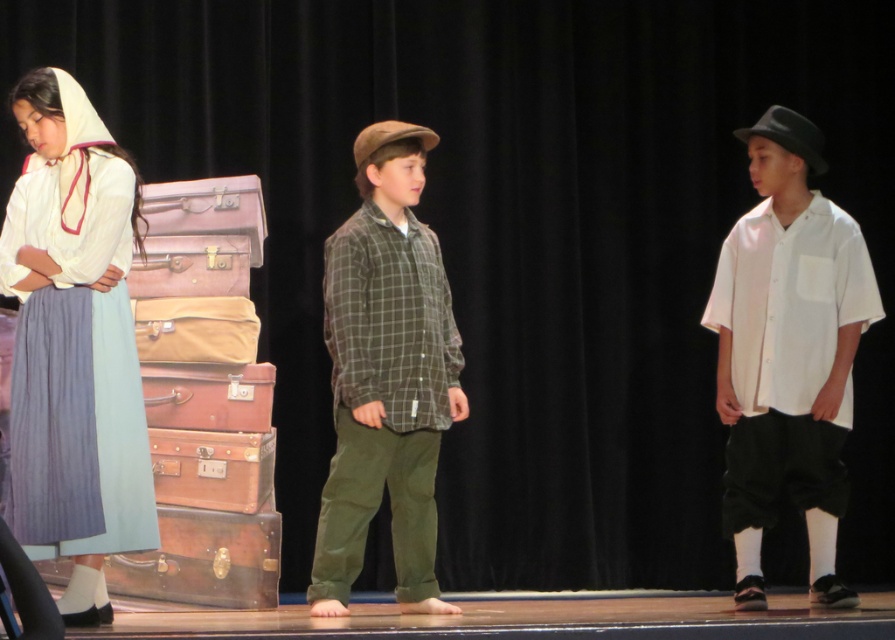
Question: Estimate the real-world distances between objects in this image. Which object is farther from the green plaid shirt at center?

Choices:
 (A) white cotton dress at left
 (B) white cotton shirt at right

Answer: (B)

Question: Does white cotton dress at left appear over transparent leather suitcase at center?

Choices:
 (A) yes
 (B) no

Answer: (A)

Question: Which point is farther to the camera?

Choices:
 (A) transparent leather suitcase at center
 (B) green plaid shirt at center
 (C) white cotton shirt at right

Answer: (A)

Question: Is white cotton dress at left bigger than transparent leather suitcase at center?

Choices:
 (A) yes
 (B) no

Answer: (A)

Question: Which object appears closest to the camera in this image?

Choices:
 (A) green plaid shirt at center
 (B) white cotton shirt at right
 (C) transparent leather suitcase at center
 (D) white cotton dress at left

Answer: (D)

Question: From the image, what is the correct spatial relationship of white cotton dress at left in relation to transparent leather suitcase at center?

Choices:
 (A) below
 (B) above

Answer: (B)